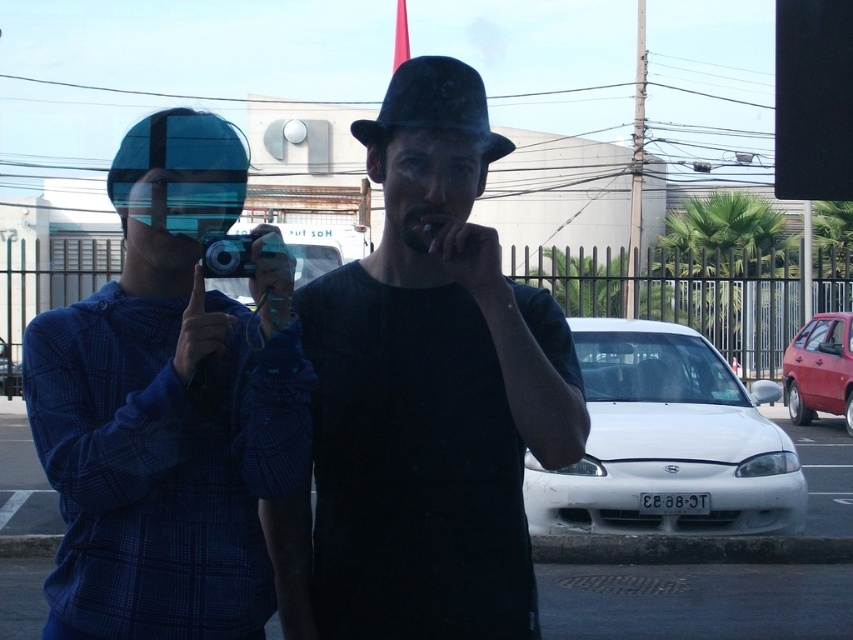
This screenshot has width=853, height=640. Describe the element at coordinates (431, 388) in the screenshot. I see `black matte hat at center` at that location.

Can you confirm if black matte hat at center is shorter than white glossy car at center?

Yes, black matte hat at center is shorter than white glossy car at center.

The image size is (853, 640). Describe the element at coordinates (431, 388) in the screenshot. I see `black matte hat at center` at that location.

The image size is (853, 640). What are the coordinates of `black matte hat at center` in the screenshot? It's located at (431, 388).

Can you confirm if blue plaid sweater at left is positioned above matte blue face at left?

No, blue plaid sweater at left is not above matte blue face at left.

Is blue plaid sweater at left below matte blue face at left?

Correct, blue plaid sweater at left is located below matte blue face at left.

Does point (228, 195) lie behind point (157, 205)?

Yes, point (228, 195) is farther from viewer.

Locate an element on the screen. blue plaid sweater at left is located at coordinates (169, 404).

Who is positioned more to the right, matte blue face at left or black felt fedora at center?

From the viewer's perspective, black felt fedora at center appears more on the right side.

Is point (196, 227) positioned in front of point (392, 132)?

No.

This screenshot has width=853, height=640. I want to click on matte blue face at left, so click(x=173, y=212).